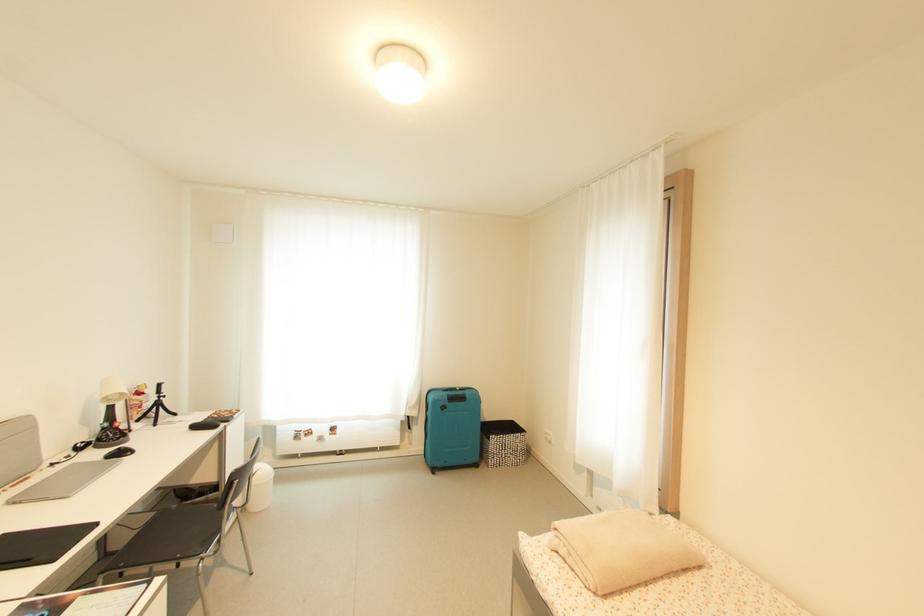
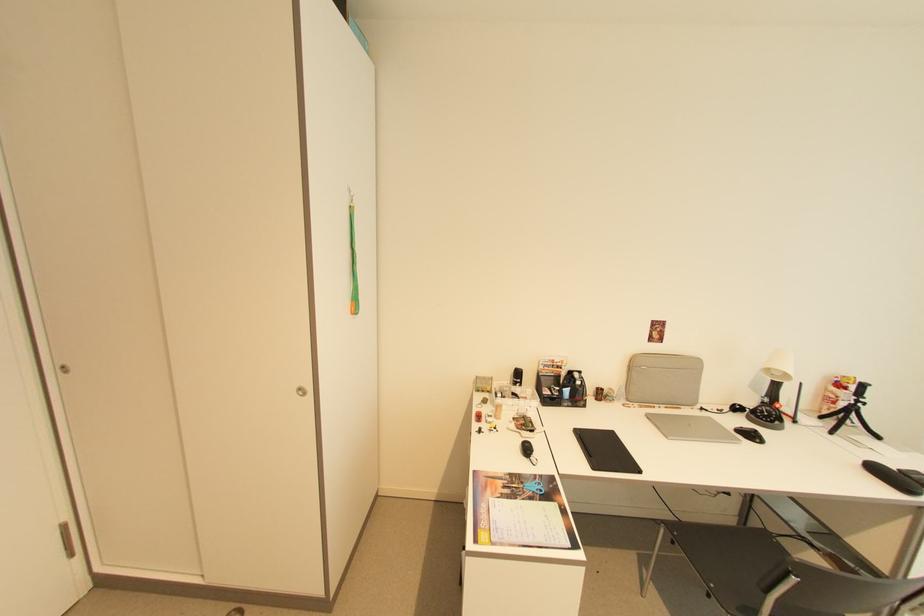
The point at (x=162, y=400) is marked in the first image. Where is the corresponding point in the second image?

(857, 405)